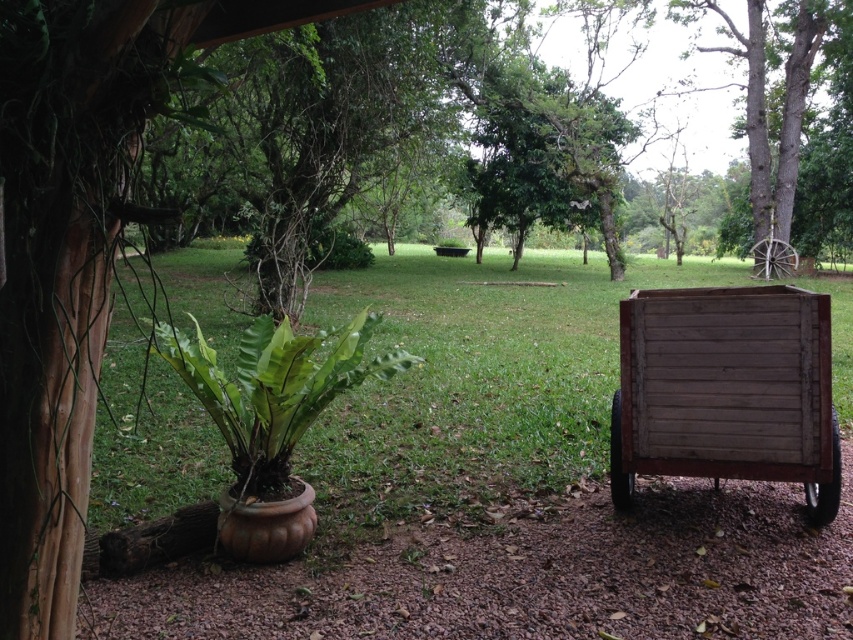
Question: Which object is closer to the camera taking this photo?

Choices:
 (A) weathered wood wagon at lower right
 (B) green grass at center

Answer: (B)

Question: Is green grass at center bigger than weathered wood wagon at lower right?

Choices:
 (A) no
 (B) yes

Answer: (B)

Question: Does green grass at center lie behind weathered wood wagon at lower right?

Choices:
 (A) yes
 (B) no

Answer: (B)

Question: Does green grass at center have a greater width compared to weathered wood wagon at lower right?

Choices:
 (A) yes
 (B) no

Answer: (A)